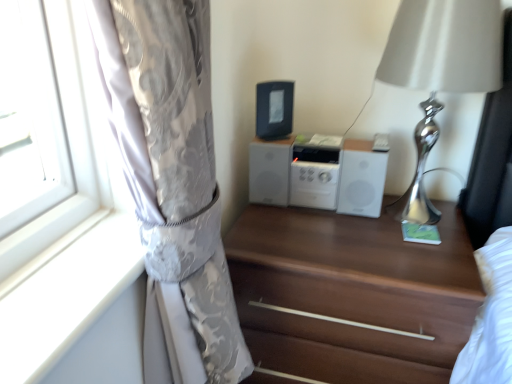
The height and width of the screenshot is (384, 512). I want to click on free area in between silver metallic table lamp at right and white matte stereo at center, so click(x=330, y=220).